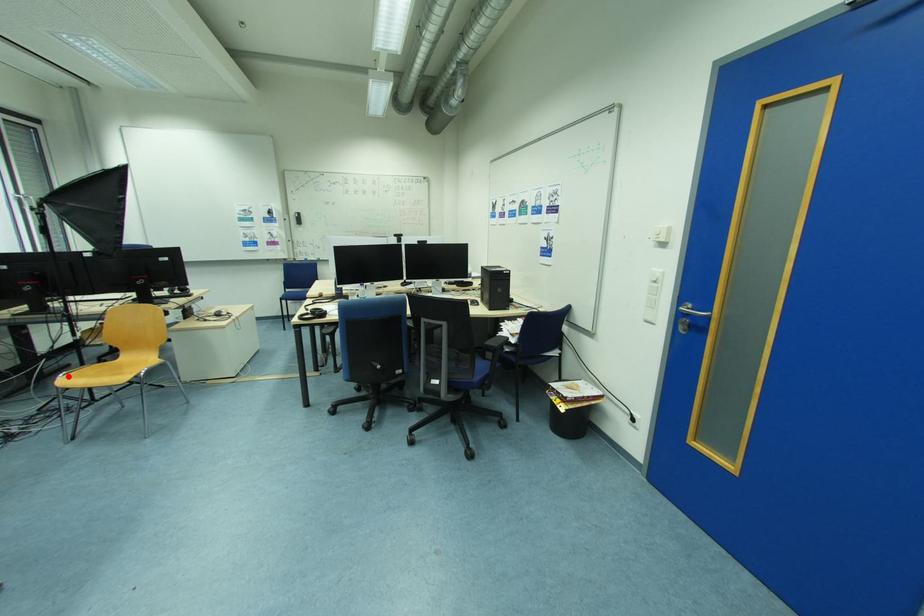
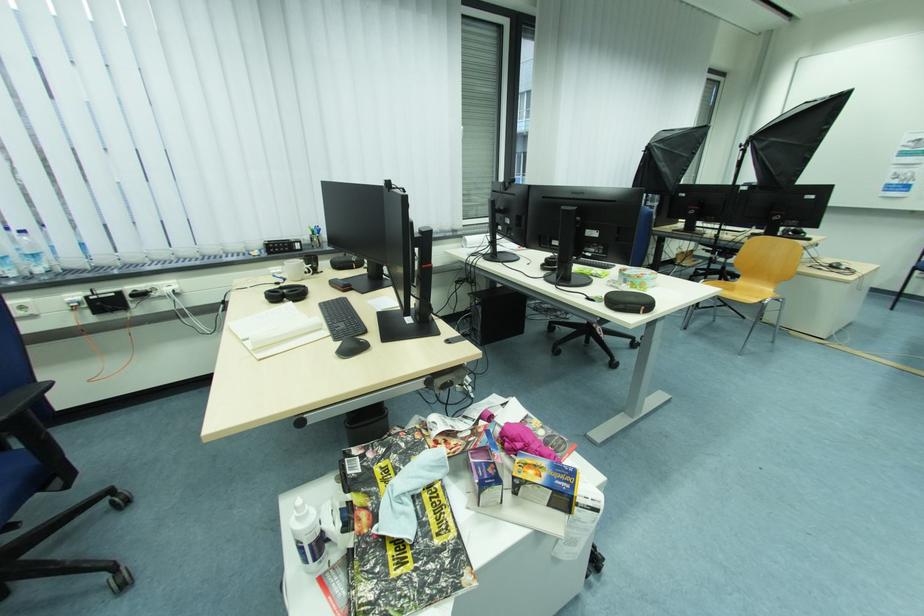
Locate, in the second image, the point that corresponds to the highlighted location in the first image.

(710, 282)